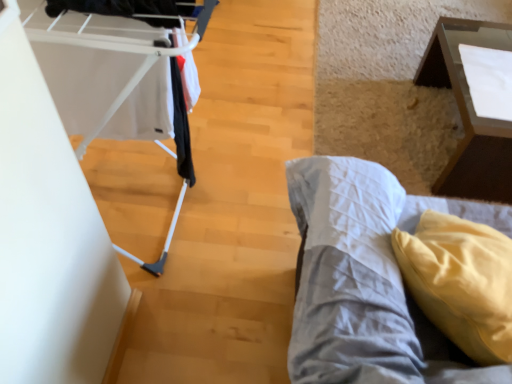
Question: Is the surface of transparent glass table at upper right in direct contact with yellow fabric pillow at lower right?

Choices:
 (A) yes
 (B) no

Answer: (B)

Question: Is transparent glass table at upper right not within yellow fabric pillow at lower right?

Choices:
 (A) yes
 (B) no

Answer: (A)

Question: Is transparent glass table at upper right at the left side of yellow fabric pillow at lower right?

Choices:
 (A) yes
 (B) no

Answer: (B)

Question: Can you confirm if transparent glass table at upper right is smaller than yellow fabric pillow at lower right?

Choices:
 (A) no
 (B) yes

Answer: (A)

Question: Considering the relative sizes of transparent glass table at upper right and yellow fabric pillow at lower right in the image provided, is transparent glass table at upper right wider than yellow fabric pillow at lower right?

Choices:
 (A) yes
 (B) no

Answer: (A)

Question: Could you tell me if transparent glass table at upper right is facing yellow fabric pillow at lower right?

Choices:
 (A) no
 (B) yes

Answer: (A)

Question: Does yellow fabric pillow at lower right have a greater height compared to transparent glass table at upper right?

Choices:
 (A) no
 (B) yes

Answer: (B)

Question: Can you confirm if yellow fabric pillow at lower right is thinner than transparent glass table at upper right?

Choices:
 (A) no
 (B) yes

Answer: (B)

Question: From a real-world perspective, is yellow fabric pillow at lower right positioned under transparent glass table at upper right based on gravity?

Choices:
 (A) yes
 (B) no

Answer: (B)

Question: Is yellow fabric pillow at lower right not close to transparent glass table at upper right?

Choices:
 (A) no
 (B) yes

Answer: (A)

Question: Can you confirm if yellow fabric pillow at lower right is shorter than transparent glass table at upper right?

Choices:
 (A) no
 (B) yes

Answer: (A)

Question: From the image's perspective, would you say yellow fabric pillow at lower right is shown under transparent glass table at upper right?

Choices:
 (A) yes
 (B) no

Answer: (A)

Question: Is white plastic baby carriage at left directly adjacent to yellow fabric pillow at lower right?

Choices:
 (A) no
 (B) yes

Answer: (A)